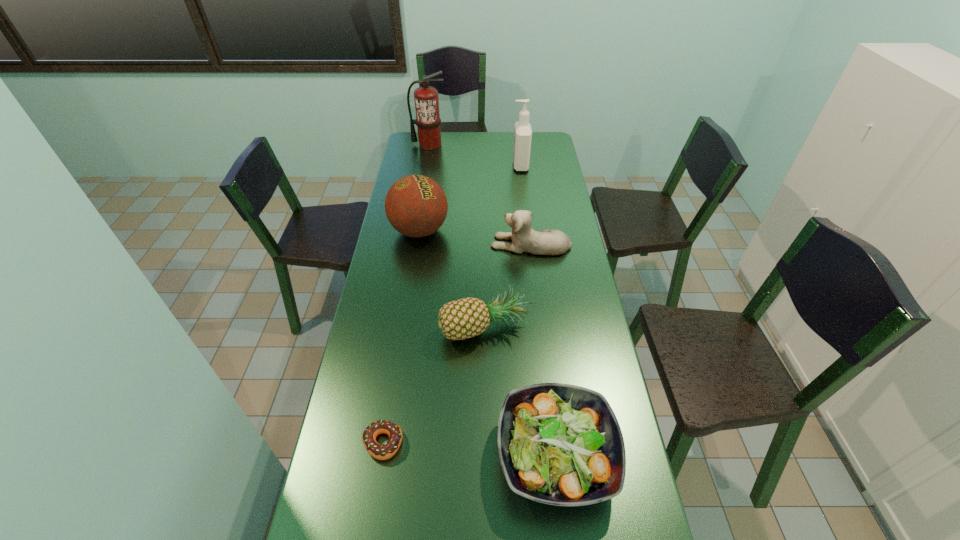
At what (x,y) coordinates should I click in order to perform the action: click on the farthest object. Please return your answer as a coordinate pair (x, y). The image size is (960, 540). Looking at the image, I should click on (428, 121).

Where is `the second farthest object`? the second farthest object is located at coordinates (522, 133).

Locate an element on the screen. This screenshot has width=960, height=540. the sixth shortest object is located at coordinates (522, 133).

Find the location of a particular element. This screenshot has width=960, height=540. the third tallest object is located at coordinates pyautogui.click(x=416, y=206).

Locate an element on the screen. This screenshot has width=960, height=540. puppy is located at coordinates (525, 239).

Find the location of a particular element. the fifth farthest object is located at coordinates (465, 318).

The height and width of the screenshot is (540, 960). What are the coordinates of `the sixth tallest object` in the screenshot? It's located at (559, 444).

The height and width of the screenshot is (540, 960). What are the coordinates of `doughnut` in the screenshot? It's located at (381, 452).

You are a GUI agent. You are given a task and a screenshot of the screen. Output one action in this format:
    pyautogui.click(x=<x>, y=<y>)
    Task: Click on the blank space located toward the nozzle of the farthest object
    This screenshot has width=960, height=540.
    Given the screenshot: What is the action you would take?
    pyautogui.click(x=425, y=170)

At what (x,y) coordinates should I click in order to perform the action: click on vacant space situated on the front label of the sixth nearest object. Please return your answer as a coordinate pair (x, y). Image resolution: width=960 pixels, height=540 pixels. Looking at the image, I should click on (447, 165).